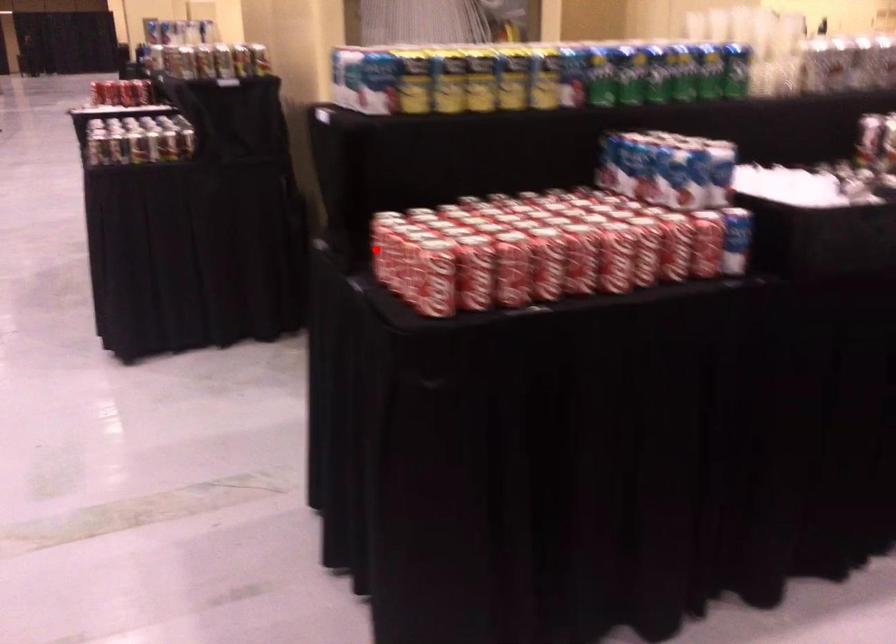
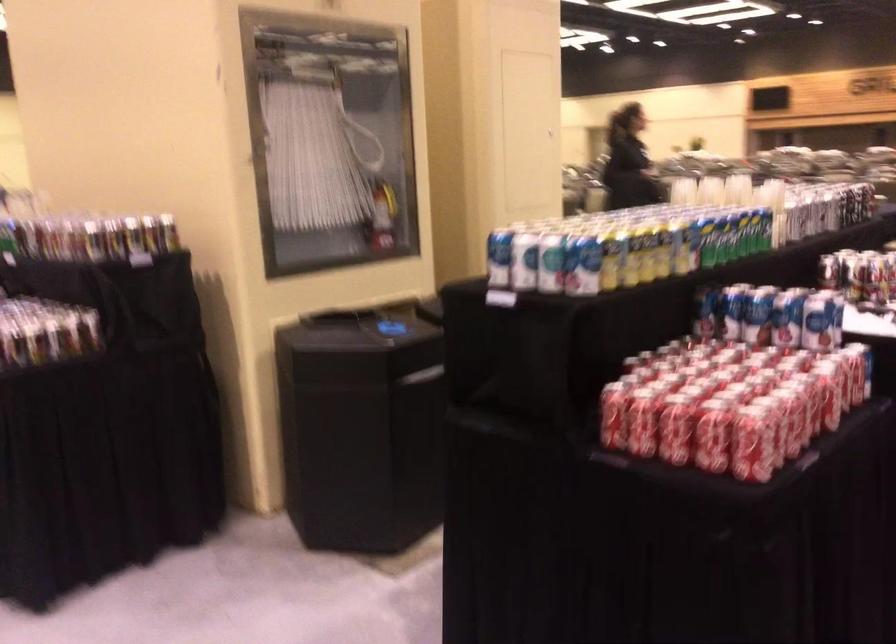
Where in the second image is the point corresponding to the highlighted location from the first image?

(642, 422)